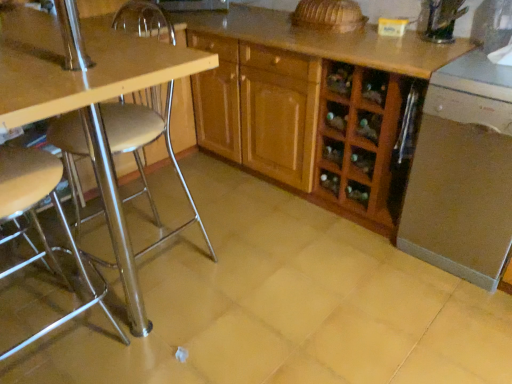
Locate an element on the screen. The height and width of the screenshot is (384, 512). vacant point to the right of wooden table at left is located at coordinates (244, 267).